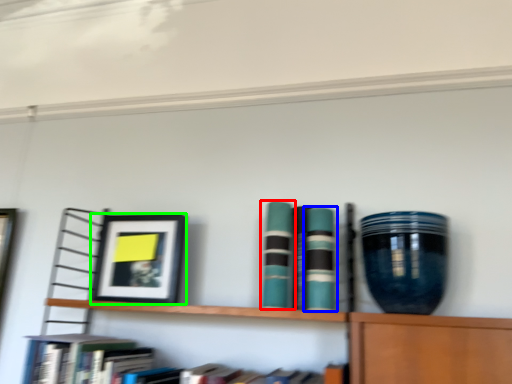
Question: Based on their relative distances, which object is nearer to book (highlighted by a red box)? Choose from book (highlighted by a blue box) and picture frame (highlighted by a green box).

Choices:
 (A) book
 (B) picture frame

Answer: (A)